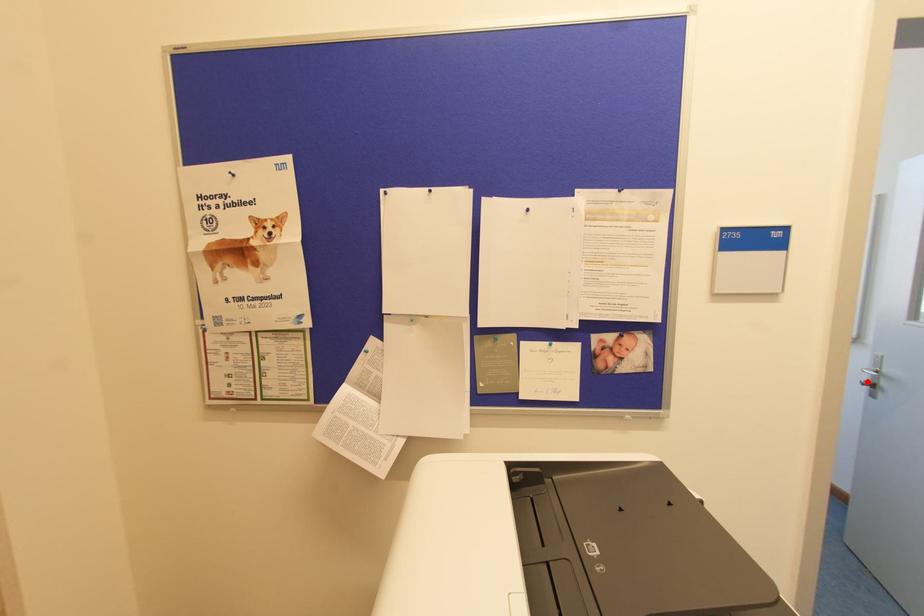
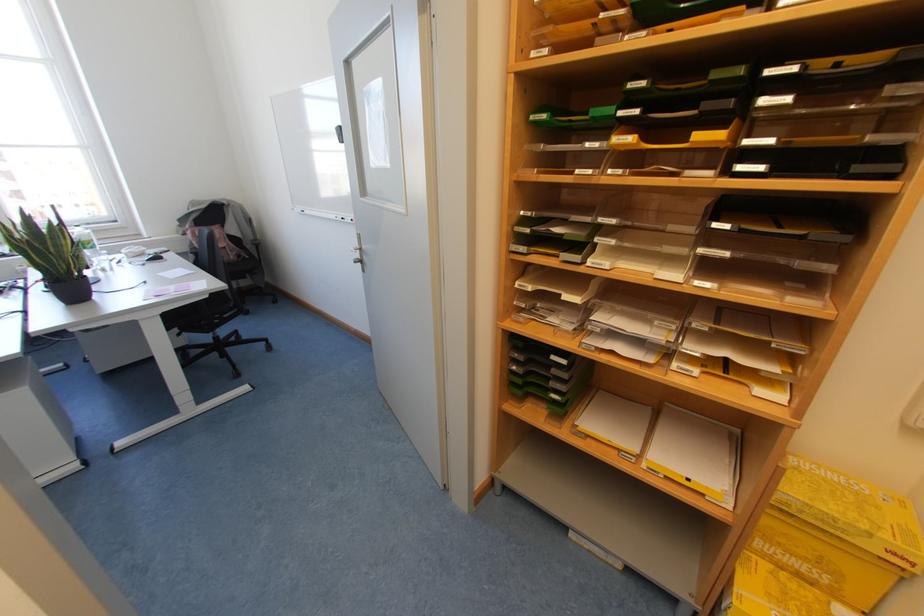
Question: I am providing you with two images of the same scene from different viewpoints. A red point is marked on the first image. Is the red point's position out of view in image 2?

Choices:
 (A) Yes
 (B) No

Answer: (B)